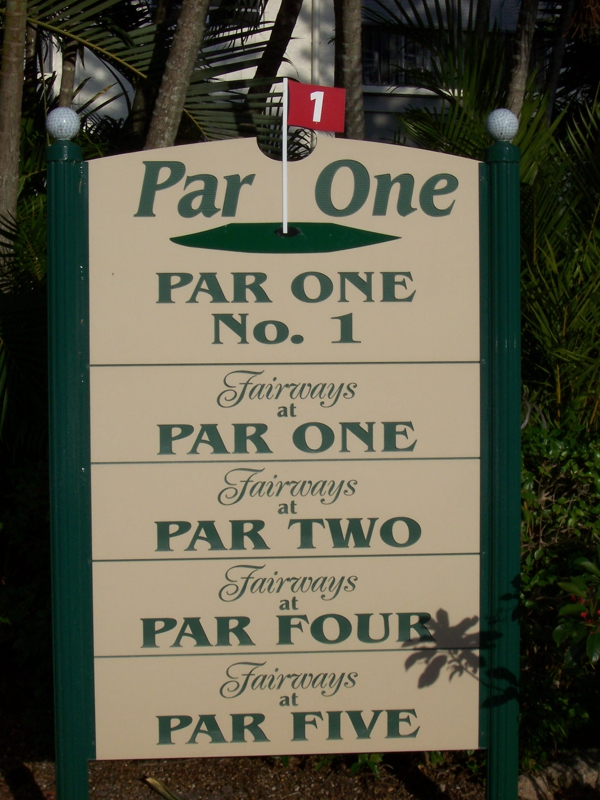
Locate an element on the screen. window is located at coordinates (506, 14).